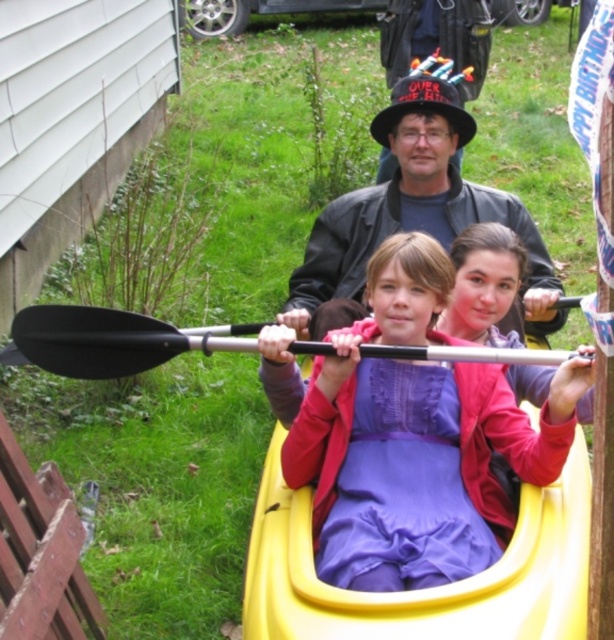
You are standing in a park and see the yellow plastic canoe at center and the black rubber paddle at center. Which object is closer to you?

The yellow plastic canoe at center is closer to you because it is in front of the black rubber paddle at center.

You are a photographer standing in front of the kayak. You need to take a photo of the matte black jacket at center and the black rubber paddle at center. Which object should you focus on first if you want to capture both clearly in the same frame without adjusting your camera settings?

The matte black jacket at center is taller than the black rubber paddle at center, so you should focus on the matte black jacket at center first to ensure both are in focus.